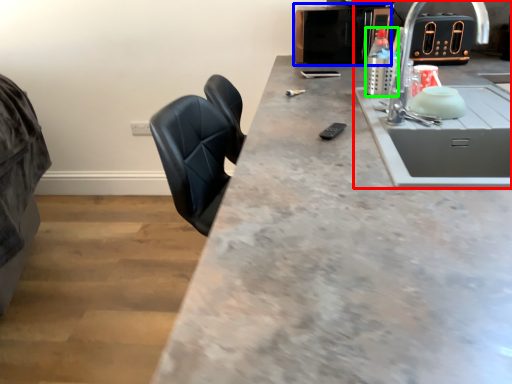
Question: Which is farther away from sink (highlighted by a red box)? appliance (highlighted by a blue box) or bottle (highlighted by a green box)?

Choices:
 (A) appliance
 (B) bottle

Answer: (A)